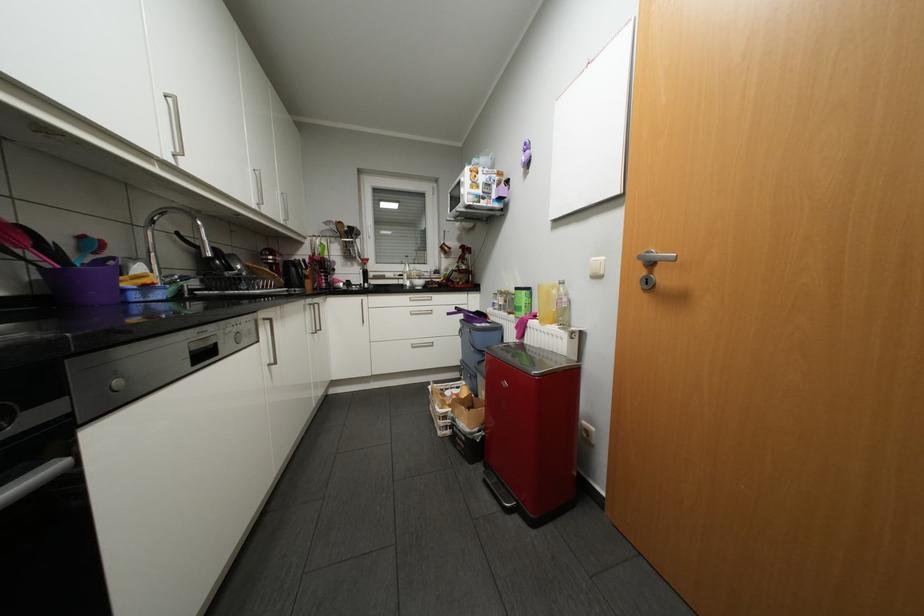
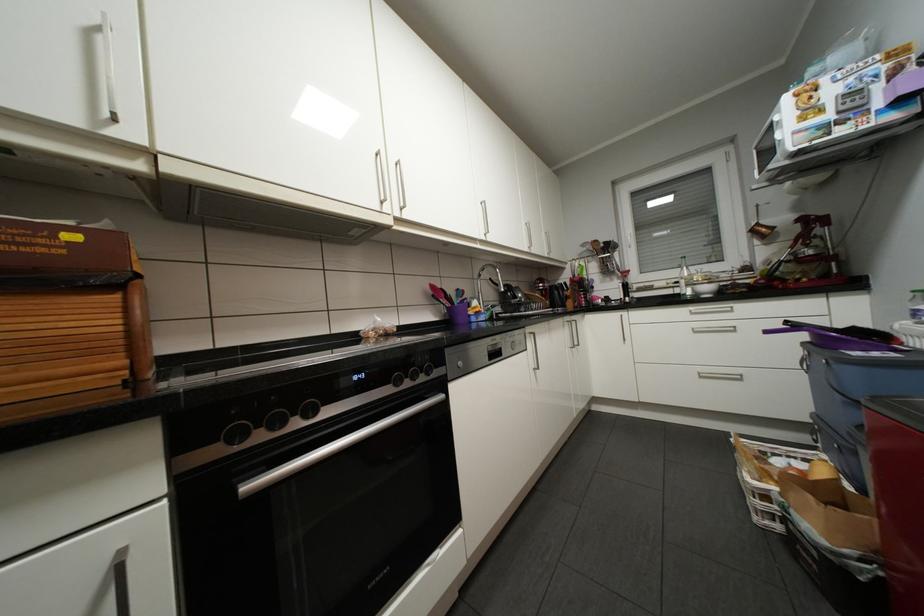
The point at [419,313] is marked in the first image. Where is the corresponding point in the second image?

(703, 331)